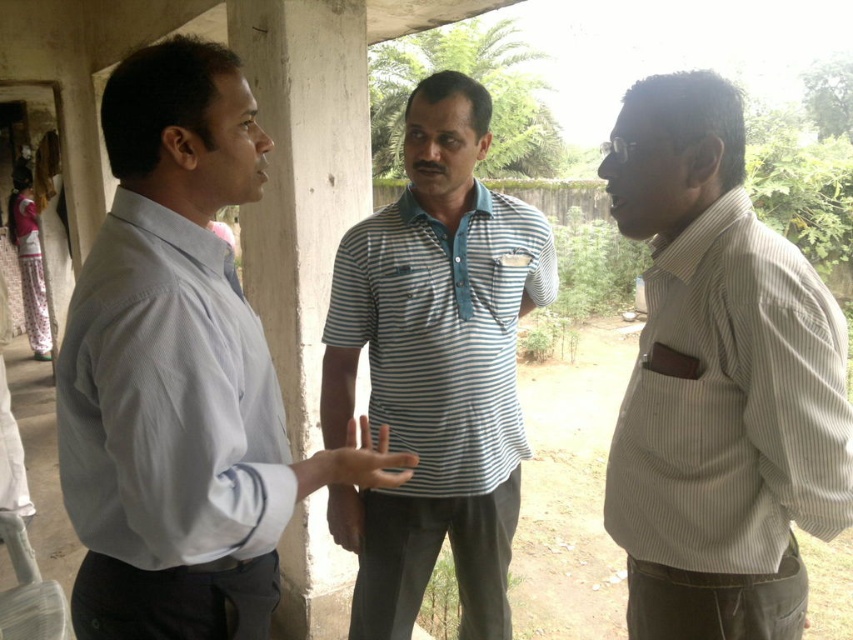
Question: Which point appears farthest from the camera in this image?

Choices:
 (A) (192, 506)
 (B) (825, 372)
 (C) (337, 378)

Answer: (C)

Question: Is white striped shirt at right to the right of blue striped shirt at center from the viewer's perspective?

Choices:
 (A) yes
 (B) no

Answer: (A)

Question: Among these points, which one is farthest from the camera?

Choices:
 (A) (762, 442)
 (B) (445, 296)
 (C) (221, 289)

Answer: (B)

Question: Is light gray shirt at left below blue striped shirt at center?

Choices:
 (A) yes
 (B) no

Answer: (B)

Question: Which of the following is the closest to the observer?

Choices:
 (A) (65, 488)
 (B) (254, 364)

Answer: (A)

Question: Does light gray shirt at left appear under light blue striped polo shirt at center?

Choices:
 (A) yes
 (B) no

Answer: (B)